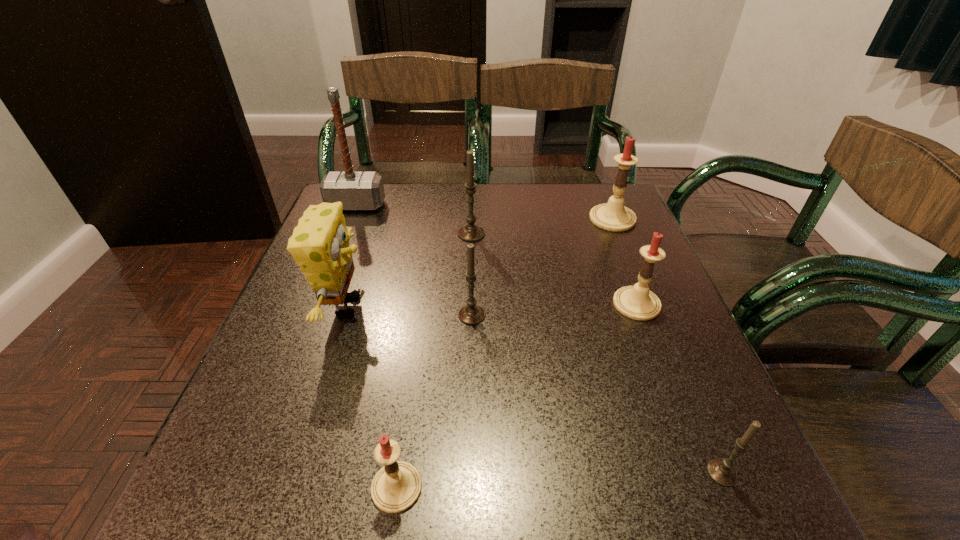
The image size is (960, 540). I want to click on the leftmost red candle, so click(396, 487).

Where is `free location located on the striking surface of the hammer`? This screenshot has height=540, width=960. free location located on the striking surface of the hammer is located at coordinates pyautogui.click(x=327, y=279).

Find the location of a particular element. The image size is (960, 540). vacant region located 0.220m on the right of the biggest gray candle is located at coordinates (573, 234).

Where is `vacant area located on the back of the biggest red candle`? Image resolution: width=960 pixels, height=540 pixels. vacant area located on the back of the biggest red candle is located at coordinates (600, 188).

You are a GUI agent. You are given a task and a screenshot of the screen. Output one action in this format:
    pyautogui.click(x=<x>, y=<y>)
    Task: Click on the vacant region located on the face of the sponge
    This screenshot has height=540, width=960.
    Given the screenshot: What is the action you would take?
    pyautogui.click(x=482, y=307)

The width and height of the screenshot is (960, 540). I want to click on vacant area situated on the back of the second biggest gray candle, so click(x=472, y=277).

Where is `vacant region located 0.380m on the back of the second smallest red candle`? vacant region located 0.380m on the back of the second smallest red candle is located at coordinates (596, 197).

Image resolution: width=960 pixels, height=540 pixels. Find the location of `vacant area situated on the left of the nearest gray candle`. vacant area situated on the left of the nearest gray candle is located at coordinates (504, 472).

Locate an element on the screen. vacant space located 0.060m on the right of the smallest red candle is located at coordinates (464, 488).

At what (x,y) coordinates should I click in order to perform the action: click on hammer at the far edge. Please return your answer as a coordinate pair (x, y). The width and height of the screenshot is (960, 540). Looking at the image, I should click on (355, 190).